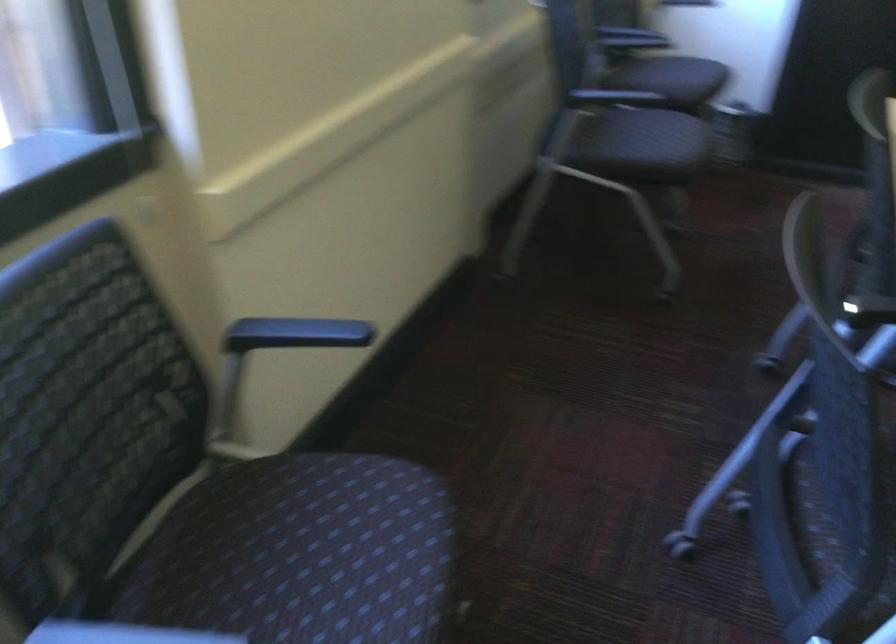
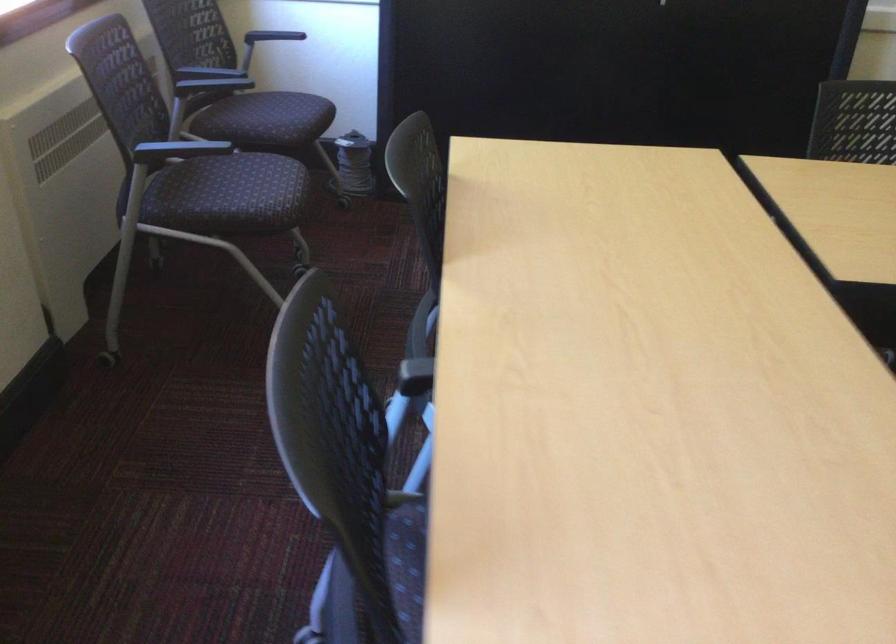
Where in the second image is the point corresponding to point (673, 79) from the first image?

(271, 120)